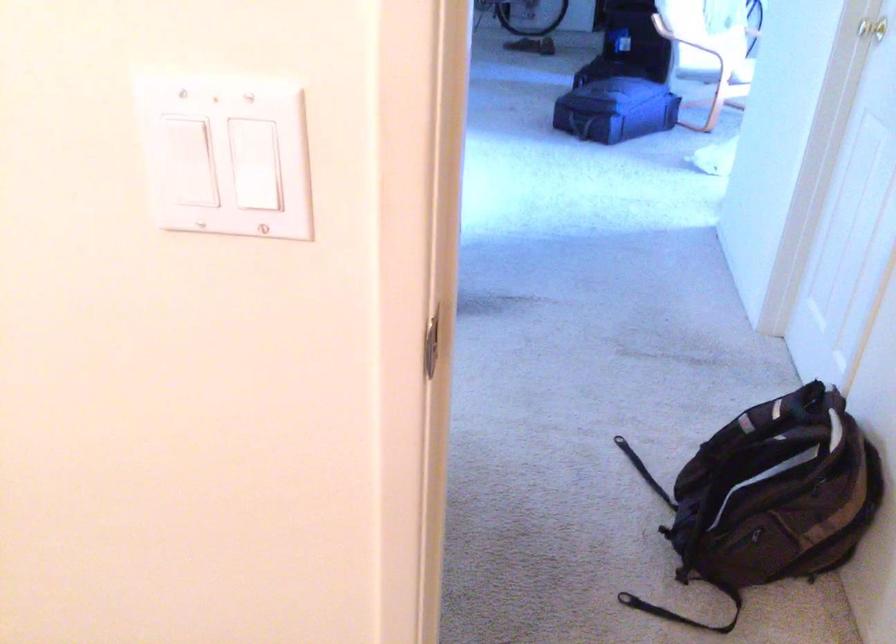
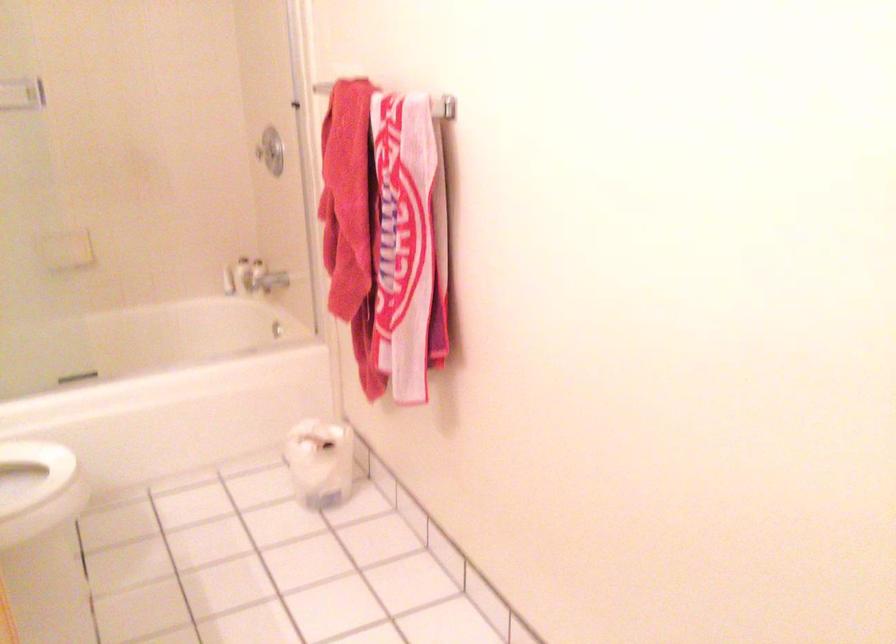
Question: How did the camera likely rotate?

Choices:
 (A) Left
 (B) Right
 (C) Up
 (D) Down

Answer: (A)